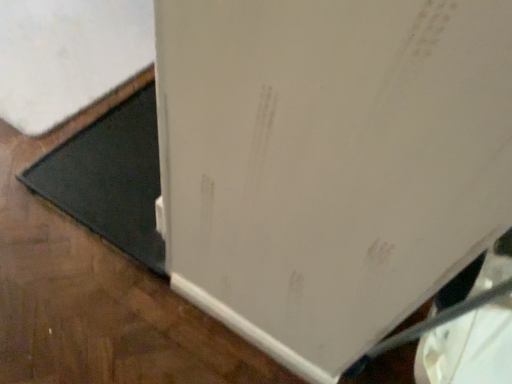
Question: Does point (343, 150) appear closer or farther from the camera than point (138, 114)?

Choices:
 (A) closer
 (B) farther

Answer: (A)

Question: Is white matte refrigerator at lower right inside or outside of black rubber doormat at lower left?

Choices:
 (A) outside
 (B) inside

Answer: (A)

Question: Considering their positions, is white matte refrigerator at lower right located in front of or behind black rubber doormat at lower left?

Choices:
 (A) front
 (B) behind

Answer: (A)

Question: Considering the positions of black rubber doormat at lower left and white matte refrigerator at lower right in the image, is black rubber doormat at lower left wider or thinner than white matte refrigerator at lower right?

Choices:
 (A) wide
 (B) thin

Answer: (B)

Question: From the image's perspective, is black rubber doormat at lower left positioned above or below white matte refrigerator at lower right?

Choices:
 (A) above
 (B) below

Answer: (B)

Question: Considering their positions, is black rubber doormat at lower left located in front of or behind white matte refrigerator at lower right?

Choices:
 (A) behind
 (B) front

Answer: (A)

Question: Looking at the image, does black rubber doormat at lower left seem bigger or smaller compared to white matte refrigerator at lower right?

Choices:
 (A) big
 (B) small

Answer: (B)